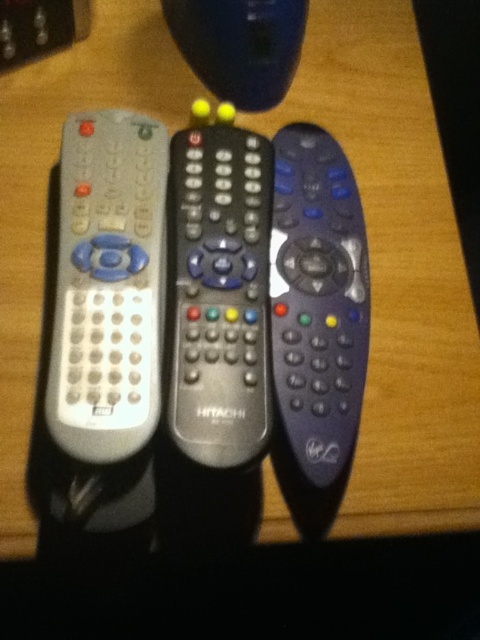
Which is more to the right, white matte remote at left or metallic gray remote at center?

From the viewer's perspective, metallic gray remote at center appears more on the right side.

How much distance is there between white matte remote at left and metallic gray remote at center?

white matte remote at left and metallic gray remote at center are 1.99 inches apart.

Between point (160, 314) and point (179, 193), which one is positioned in front?

Point (160, 314) is more forward.

Locate an element on the screen. This screenshot has width=480, height=640. white matte remote at left is located at coordinates (108, 285).

Who is positioned more to the left, white matte remote at left or matte black remote at center?

Positioned to the left is white matte remote at left.

Find the location of a particular element. Image resolution: width=480 pixels, height=640 pixels. white matte remote at left is located at coordinates (108, 285).

Which is more to the left, metallic gray remote at center or matte black remote at center?

From the viewer's perspective, metallic gray remote at center appears more on the left side.

Between point (204, 188) and point (348, 353), which one is positioned behind?

The point (204, 188) is behind.

The image size is (480, 640). Find the location of `metallic gray remote at center`. metallic gray remote at center is located at coordinates (218, 292).